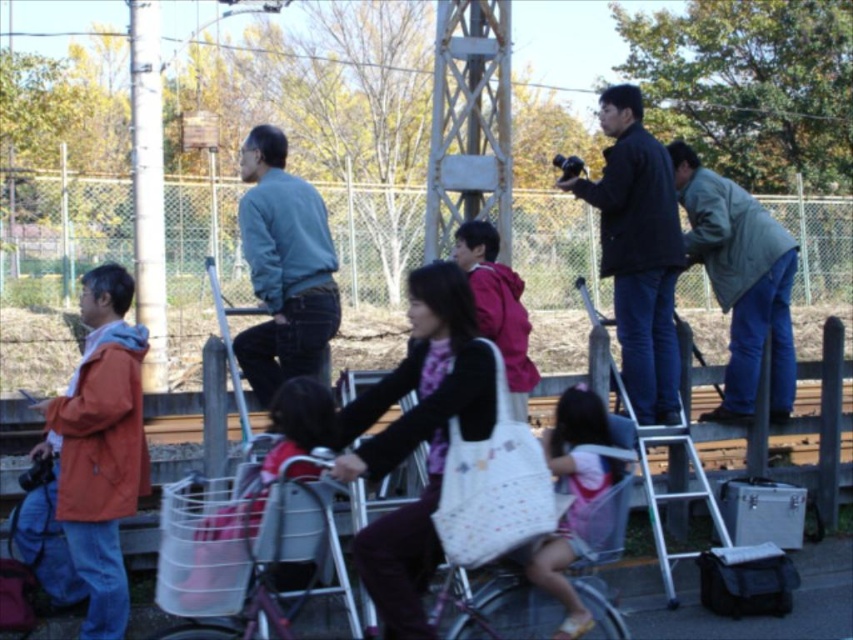
Question: Does dark blue jacket at center appear on the right side of pink fabric dress at center?

Choices:
 (A) no
 (B) yes

Answer: (B)

Question: Does pink fabric dress at center appear on the right side of matte pink jacket at center?

Choices:
 (A) yes
 (B) no

Answer: (A)

Question: Is metallic silver bicycle at center thinner than pink fabric dress at center?

Choices:
 (A) yes
 (B) no

Answer: (B)

Question: Among these points, which one is farthest from the camera?

Choices:
 (A) (254, 369)
 (B) (683, 170)
 (C) (674, 218)
 (D) (486, 337)

Answer: (B)

Question: Based on their relative distances, which object is farther from the metallic silver bicycle at center?

Choices:
 (A) dark blue jacket at center
 (B) matte pink jacket at center
 (C) pink fabric dress at center

Answer: (A)

Question: Which point is farther from the camera taking this photo?

Choices:
 (A) (567, 481)
 (B) (445, 572)

Answer: (B)